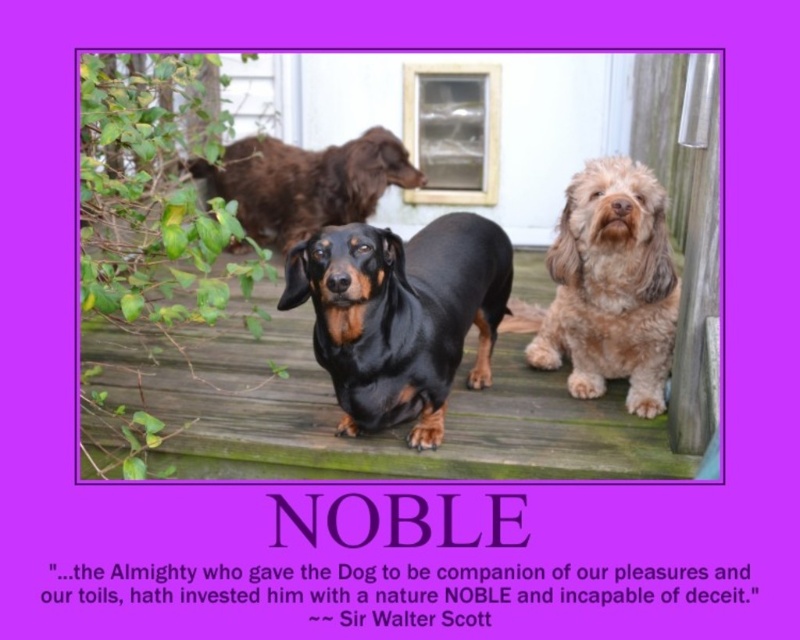
You are a dog owner who wants to choose a dog to walk. You see the fuzzy brown dog at center and the shiny brown fur at upper center. Which dog is larger?

The fuzzy brown dog at center is bigger than the shiny brown fur at upper center, so the fuzzy brown dog at center is larger.

You are a photographer setting up a tripod to take a group photo of the black shiny dachshund at center and the shiny brown fur at upper center. Since you want both dogs to be in the same frame, which direction should you move the tripod to align them properly?

The black shiny dachshund at center is to the right of shiny brown fur at upper center, so you should move the tripod to the left to align both dogs in the same frame.

You are a photographer setting up a tripod to take a group photo of the fuzzy brown dog at center and the shiny brown fur at upper center. Which dog should you position closer to the front of the frame to ensure both are in focus?

You should position the shiny brown fur at upper center closer to the front of the frame because it is shorter than the fuzzy brown dog at center, ensuring both can be in focus.